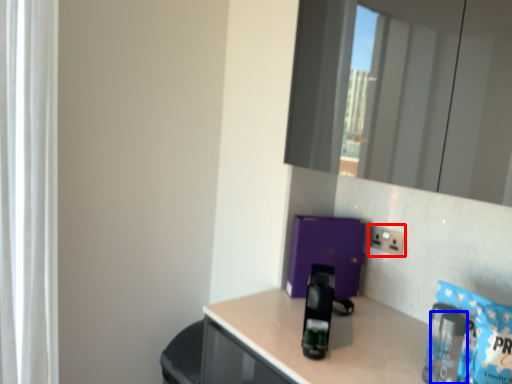
Question: Which object appears closest to the camera in this image, electric outlet (highlighted by a red box) or bottle (highlighted by a blue box)?

Choices:
 (A) electric outlet
 (B) bottle

Answer: (B)